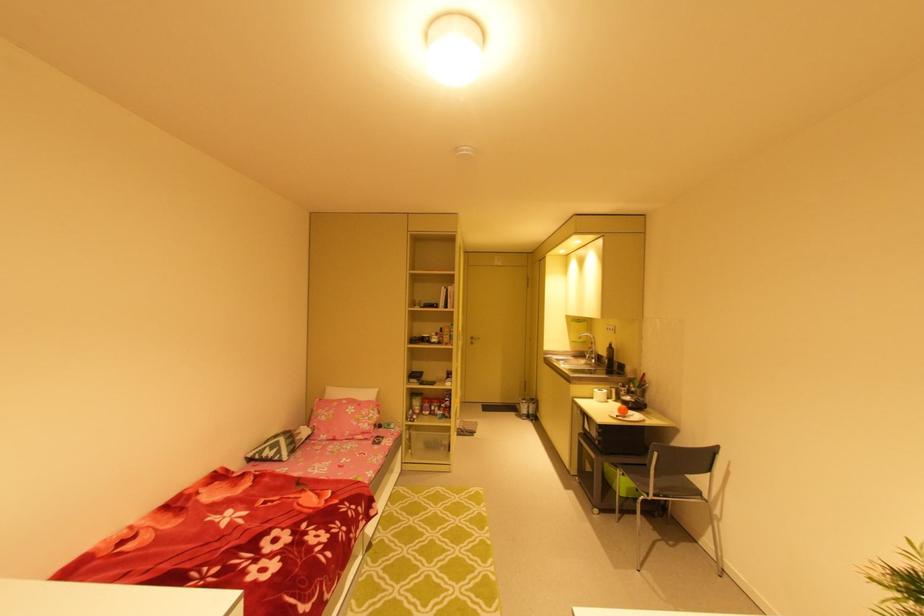
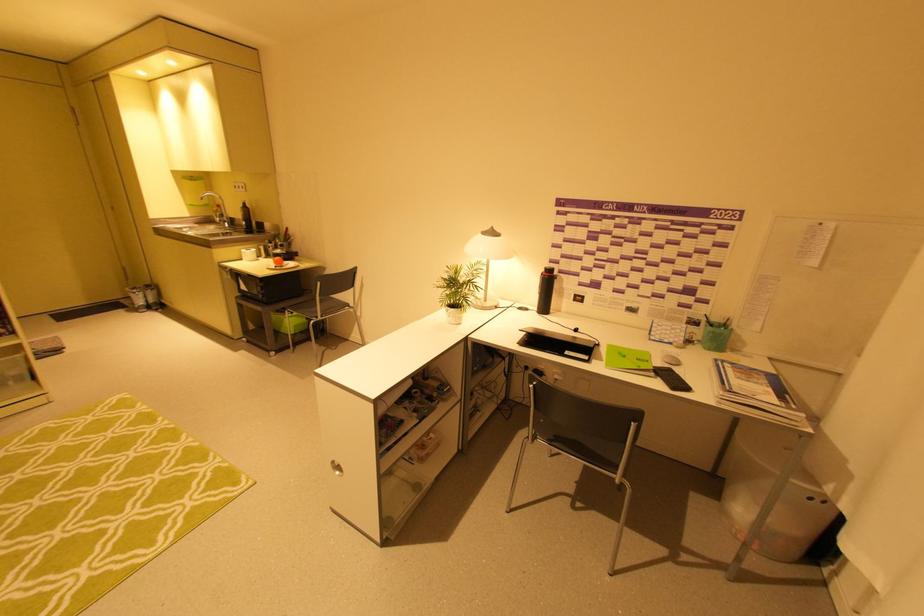
Locate, in the second image, the point that corresponds to (626,414) in the first image.

(283, 265)